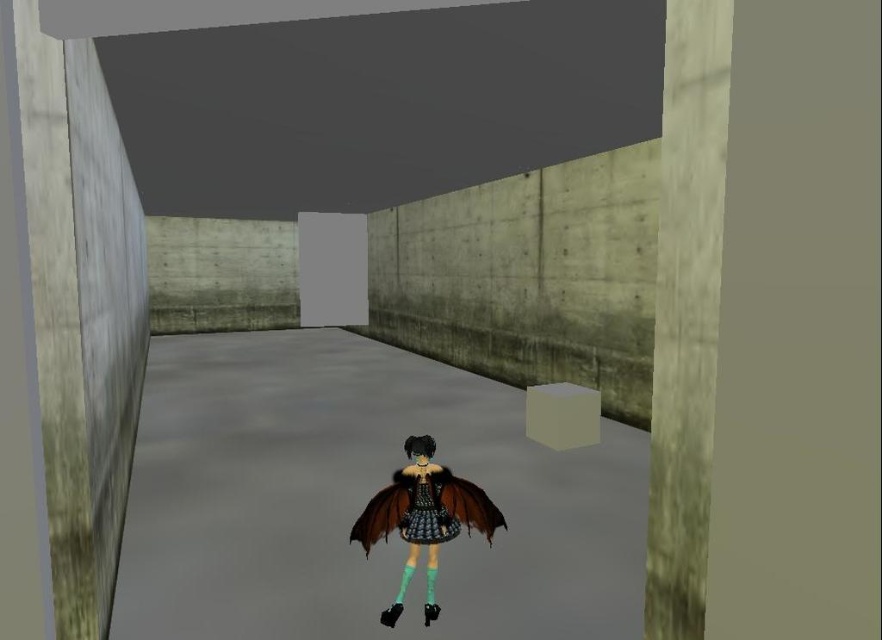
In order to click on smooth concrete pillar at left in this screenshot , I will do `click(81, 310)`.

How far apart are smooth concrete pillar at left and concrete wall at right?

smooth concrete pillar at left and concrete wall at right are 2.53 meters apart from each other.

Is point (116, 289) farther from camera compared to point (690, 220)?

Yes, it is behind point (690, 220).

The width and height of the screenshot is (882, 640). I want to click on smooth concrete pillar at left, so click(81, 310).

Is shiny black dress at center above shiny black lace dress at center?

Incorrect, shiny black dress at center is not positioned above shiny black lace dress at center.

Does shiny black dress at center have a smaller size compared to shiny black lace dress at center?

No.

Measure the distance between point (377,506) and camera.

9.07 feet

Identify the location of shiny black dress at center. (423, 516).

Which of these two, smooth concrete pillar at left or shiny black lace dress at center, stands taller?

Standing taller between the two is smooth concrete pillar at left.

Is point (81, 387) in front of point (417, 509)?

Yes, it is in front of point (417, 509).

Identify the location of smooth concrete pillar at left. The height and width of the screenshot is (640, 882). (81, 310).